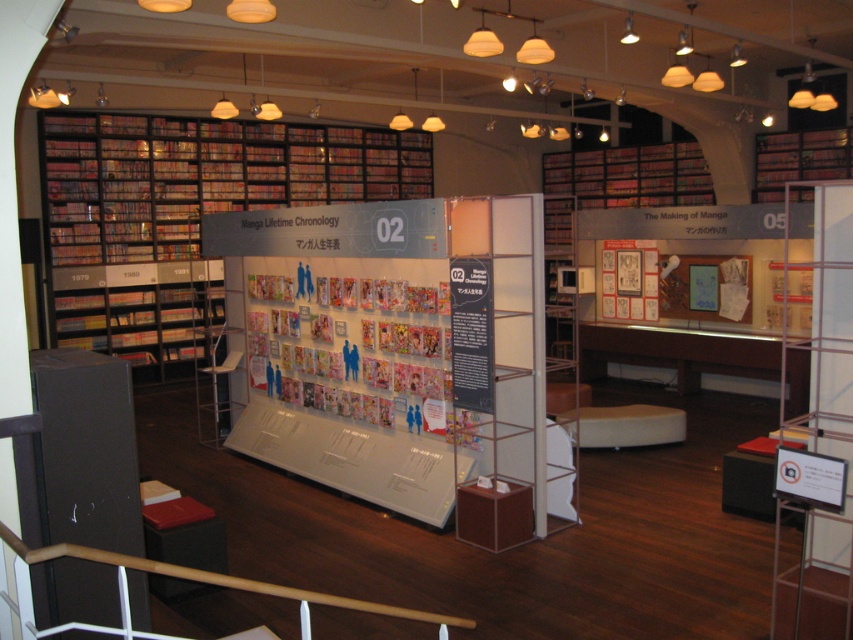
Question: Among these objects, which one is nearest to the camera?

Choices:
 (A) matte gray display at center
 (B) matte black bookshelf at left

Answer: (A)

Question: Can you confirm if matte gray display at center is thinner than matte black bookshelf at left?

Choices:
 (A) yes
 (B) no

Answer: (B)

Question: Does matte gray display at center have a larger size compared to matte black bookshelf at left?

Choices:
 (A) yes
 (B) no

Answer: (A)

Question: Does matte gray display at center appear on the left side of matte black bookshelf at left?

Choices:
 (A) no
 (B) yes

Answer: (A)

Question: Which point is closer to the camera?

Choices:
 (A) matte black bookshelf at left
 (B) matte gray display at center

Answer: (B)

Question: Which point is farther from the camera taking this photo?

Choices:
 (A) [363, 140]
 (B) [268, 368]

Answer: (A)